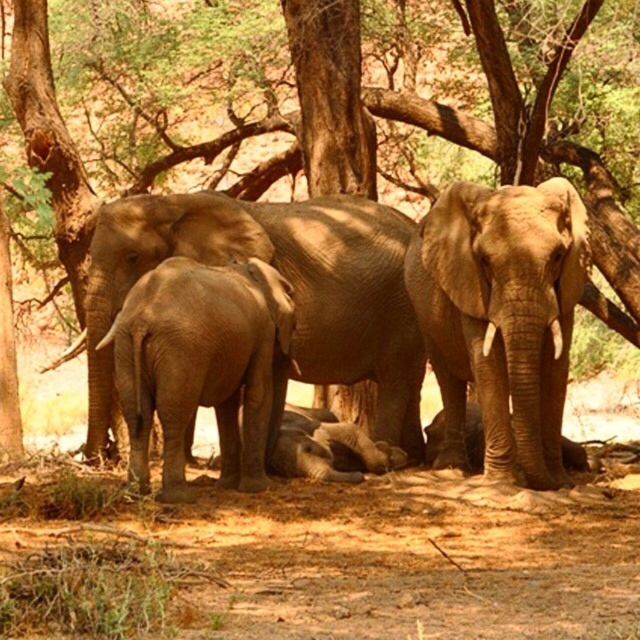
Question: Does gray textured elephant at center have a lesser width compared to smooth gray elephant at center?

Choices:
 (A) no
 (B) yes

Answer: (A)

Question: Among these objects, which one is farthest from the camera?

Choices:
 (A) smooth gray elephant at center
 (B) matte brown elephant at center

Answer: (B)

Question: Among these objects, which one is nearest to the camera?

Choices:
 (A) matte brown elephant at center
 (B) brown sandy dirt at center
 (C) smooth gray elephant at center

Answer: (B)

Question: Is brown sandy dirt at center positioned at the back of brown textured tree at center?

Choices:
 (A) no
 (B) yes

Answer: (A)

Question: Does gray textured elephant at center have a lesser width compared to brown textured tree at center?

Choices:
 (A) yes
 (B) no

Answer: (A)

Question: Which of these objects is positioned farthest from the gray textured elephant at center?

Choices:
 (A) matte brown elephant at center
 (B) brown sandy dirt at center
 (C) brown textured tree at center
 (D) smooth gray elephant at center

Answer: (C)